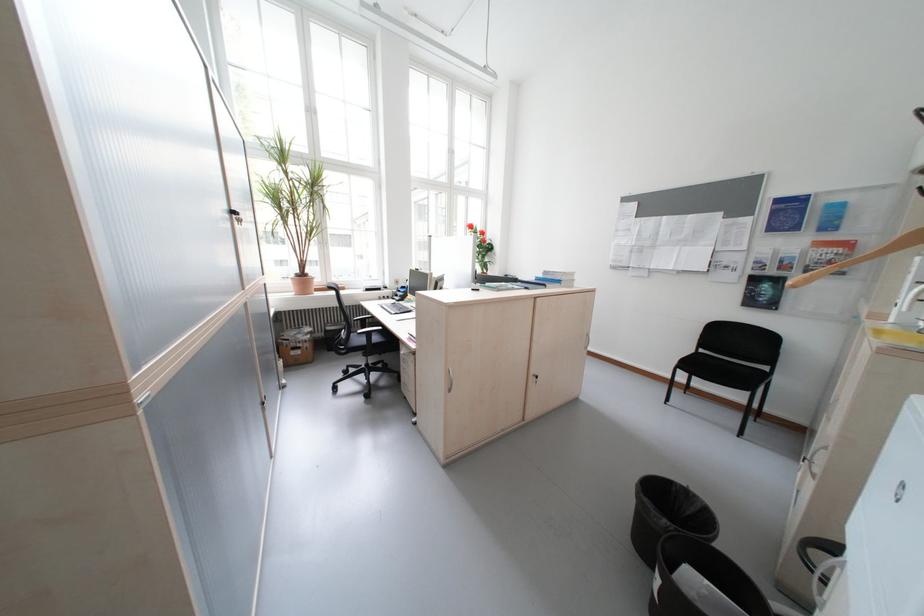
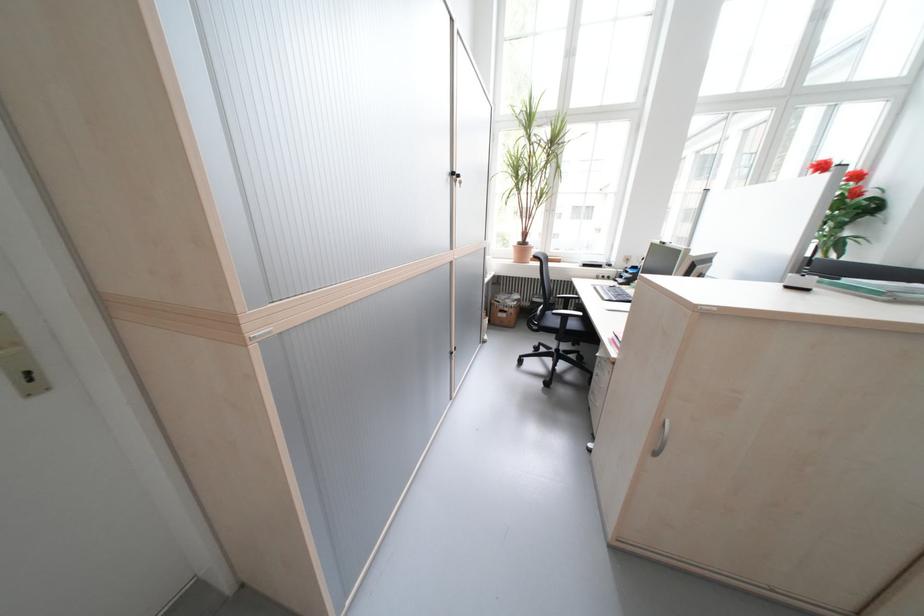
In the second image, find the point that corresponds to [309,353] in the first image.

(515, 315)